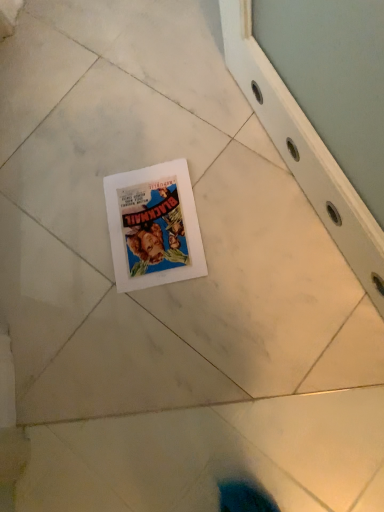
Find the location of a particular element. Image resolution: width=384 pixels, height=512 pixels. vacant area that is in front of matte paper comic book at center is located at coordinates (201, 312).